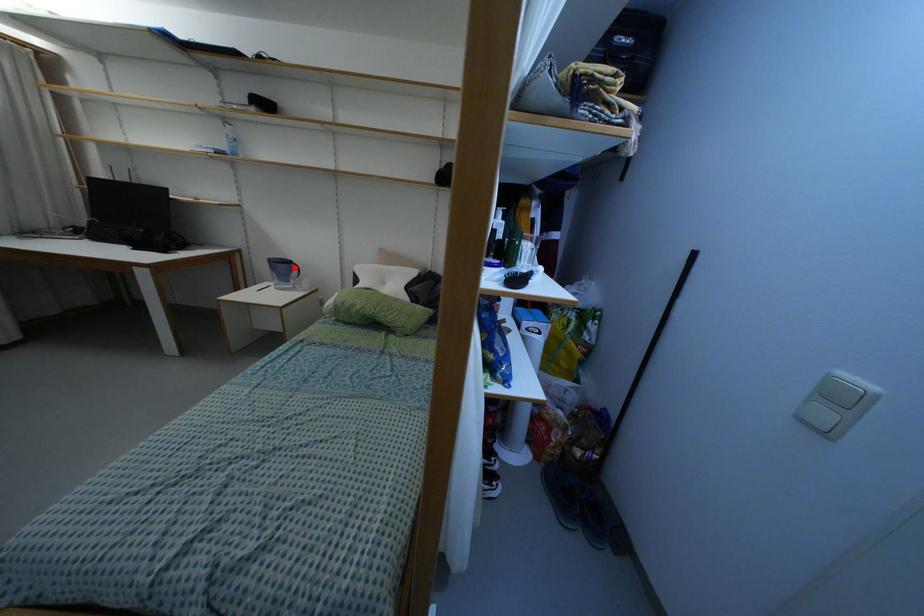
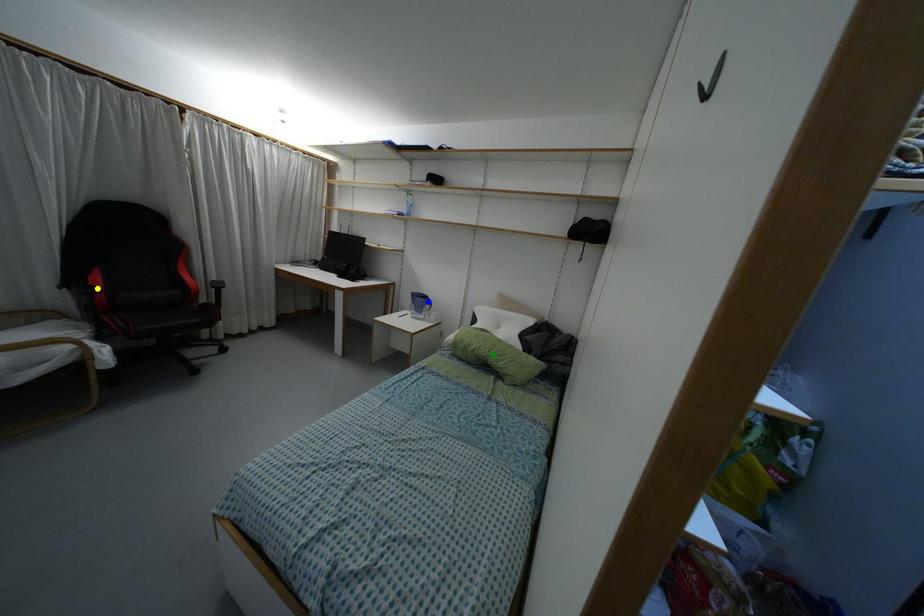
Question: I am providing you with two images of the same scene from different viewpoints. A red point is marked on the first image. You are given multiple points on the second image. In image 2, which mark is for the same physical point as the one in image 1?

Choices:
 (A) green point
 (B) yellow point
 (C) blue point

Answer: (C)